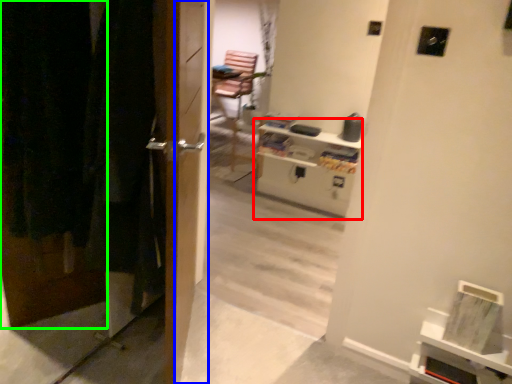
Question: Estimate the real-world distances between objects in this image. Which object is closer to entertainment center (highlighted by a red box), screen door (highlighted by a blue box) or door (highlighted by a green box)?

Choices:
 (A) screen door
 (B) door

Answer: (A)